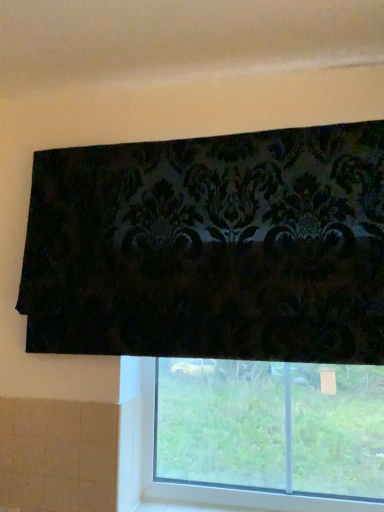
Locate an element on the screen. transparent glass window at center is located at coordinates (269, 434).

Describe the element at coordinates (269, 434) in the screenshot. I see `transparent glass window at center` at that location.

In order to face transparent glass window at center, should I rotate leftwards or rightwards?

Turn right by 9.065 degrees to look at transparent glass window at center.

The height and width of the screenshot is (512, 384). I want to click on transparent glass window at center, so click(269, 434).